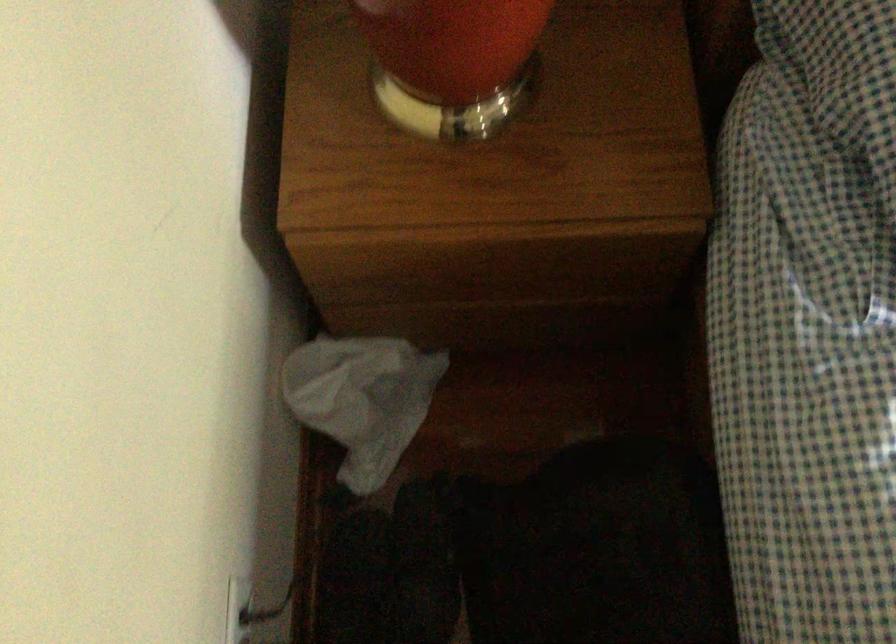
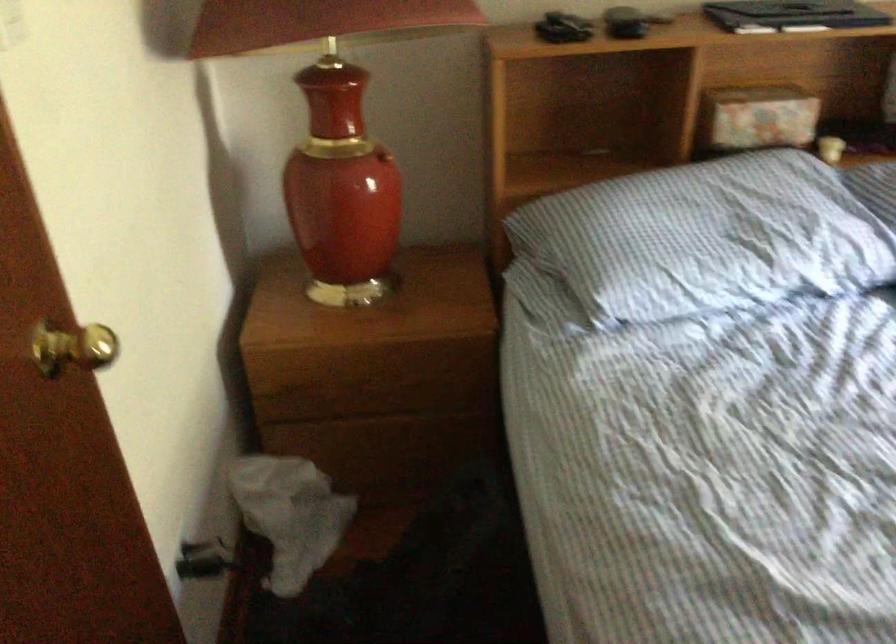
Find the pixel in the second image that matches (x=269, y=540) in the first image.

(204, 560)